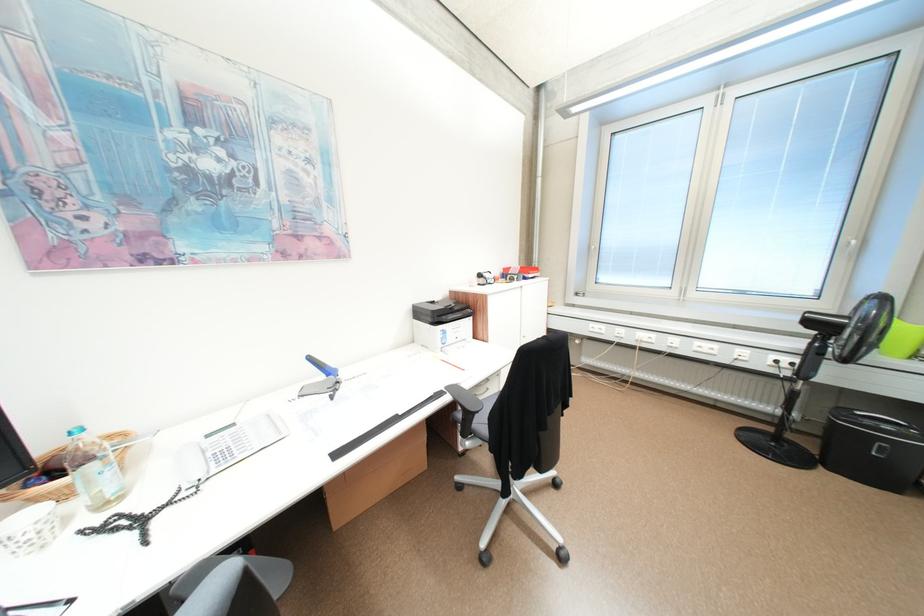
Identify the location of small red box. (520, 270).